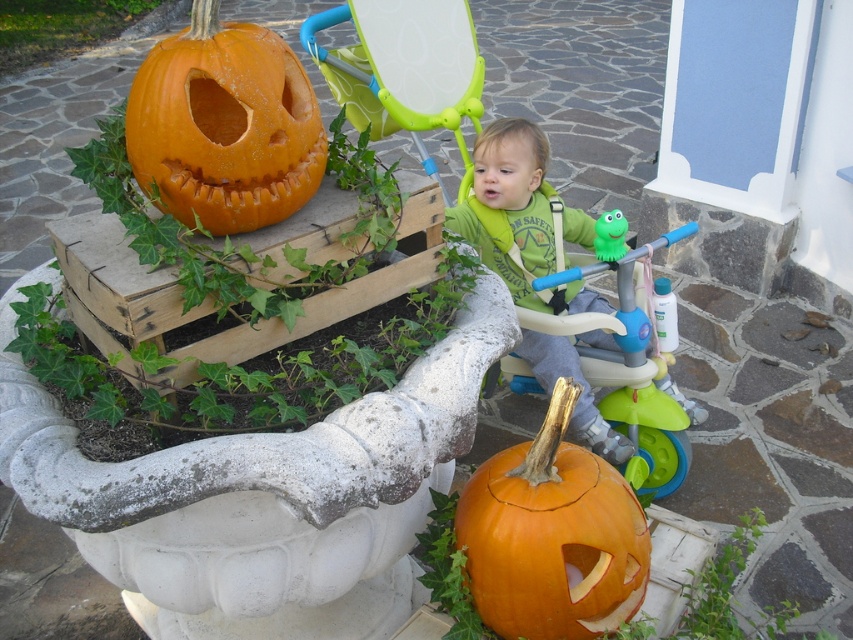
Question: Which point appears closest to the camera in this image?

Choices:
 (A) coord(573,352)
 (B) coord(492,188)
 (C) coord(613,212)

Answer: (C)

Question: Does green plastic baby carriage at center appear on the right side of orange matte pumpkin at upper left?

Choices:
 (A) yes
 (B) no

Answer: (A)

Question: Which point appears closest to the camera in this image?

Choices:
 (A) (503, 252)
 (B) (607, 220)
 (C) (479, 198)

Answer: (B)

Question: Which object is farther from the camera taking this photo?

Choices:
 (A) green rubber toy at center
 (B) green plastic baby carriage at center

Answer: (A)

Question: Is green plastic baby carriage at center thinner than green matte shirt at center?

Choices:
 (A) no
 (B) yes

Answer: (A)

Question: Considering the relative positions of green matte shirt at center and green rubber toy at center in the image provided, where is green matte shirt at center located with respect to green rubber toy at center?

Choices:
 (A) below
 (B) above

Answer: (A)